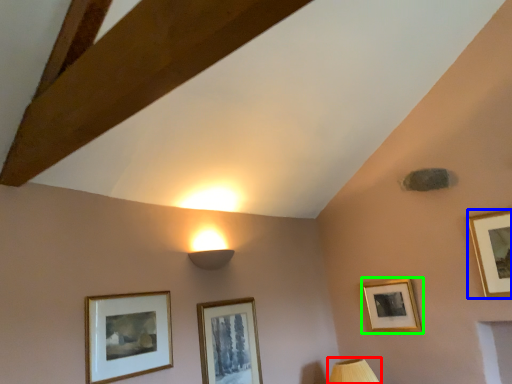
Question: Considering the real-world distances, which object is farthest from table lamp (highlighted by a red box)? picture frame (highlighted by a blue box) or picture frame (highlighted by a green box)?

Choices:
 (A) picture frame
 (B) picture frame

Answer: (A)